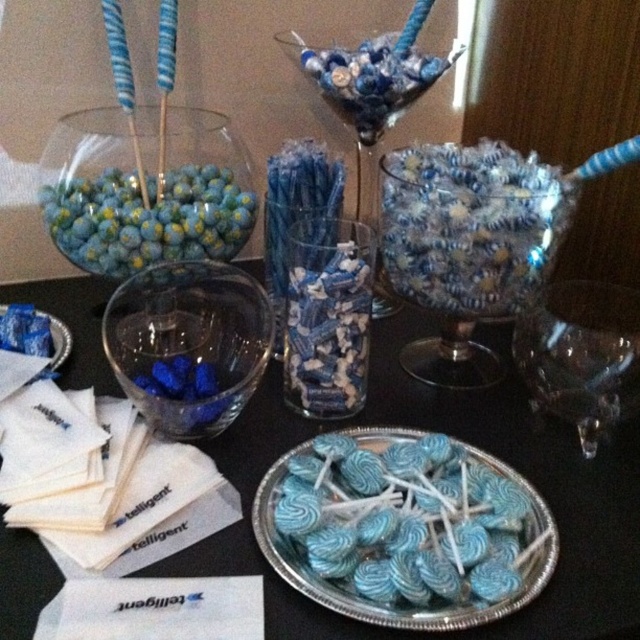
Can you confirm if translucent glass bowl at center is positioned above transparent glass at center?

Indeed, translucent glass bowl at center is positioned over transparent glass at center.

Can you confirm if translucent glass bowl at center is positioned to the right of transparent glass at center?

Indeed, translucent glass bowl at center is positioned on the right side of transparent glass at center.

Which is behind, point (467, 284) or point (188, 435)?

Positioned behind is point (467, 284).

Image resolution: width=640 pixels, height=640 pixels. What are the coordinates of `translucent glass bowl at center` in the screenshot? It's located at (467, 244).

In the scene shown: Does blue glossy lollipops at center have a lesser width compared to transparent glass at center?

No.

Does blue glossy lollipops at center appear over transparent glass at center?

Incorrect, blue glossy lollipops at center is not positioned above transparent glass at center.

Where is `blue glossy lollipops at center`? The image size is (640, 640). blue glossy lollipops at center is located at coordinates (404, 529).

Can you confirm if blue glossy lollipops at center is positioned to the left of transparent glass wine glass at center?

Indeed, blue glossy lollipops at center is positioned on the left side of transparent glass wine glass at center.

Which is above, blue glossy lollipops at center or transparent glass wine glass at center?

Positioned higher is transparent glass wine glass at center.

Find the location of a particular element. Image resolution: width=640 pixels, height=640 pixels. blue glossy lollipops at center is located at coordinates (404, 529).